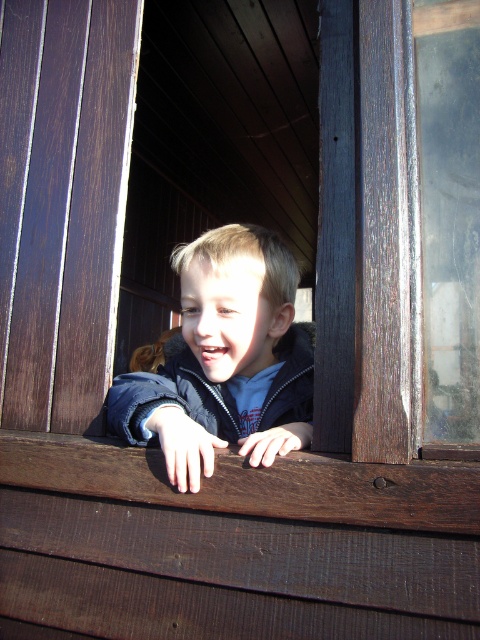
Question: Can you confirm if matte blue jacket at center is positioned to the right of blue fleece sweatshirt at center?

Choices:
 (A) yes
 (B) no

Answer: (A)

Question: Among these objects, which one is farthest from the camera?

Choices:
 (A) transparent glass window at right
 (B) matte blue jacket at center
 (C) blue fleece sweatshirt at center

Answer: (C)

Question: Which is nearer to the transparent glass window at right?

Choices:
 (A) blue fleece sweatshirt at center
 (B) matte blue jacket at center

Answer: (B)

Question: Does transparent glass window at right appear on the left side of blue fleece sweatshirt at center?

Choices:
 (A) no
 (B) yes

Answer: (A)

Question: Considering the relative positions of matte blue jacket at center and blue fleece sweatshirt at center in the image provided, where is matte blue jacket at center located with respect to blue fleece sweatshirt at center?

Choices:
 (A) below
 (B) above

Answer: (B)

Question: Among these points, which one is nearest to the camera?

Choices:
 (A) (179, 374)
 (B) (188, 356)

Answer: (A)